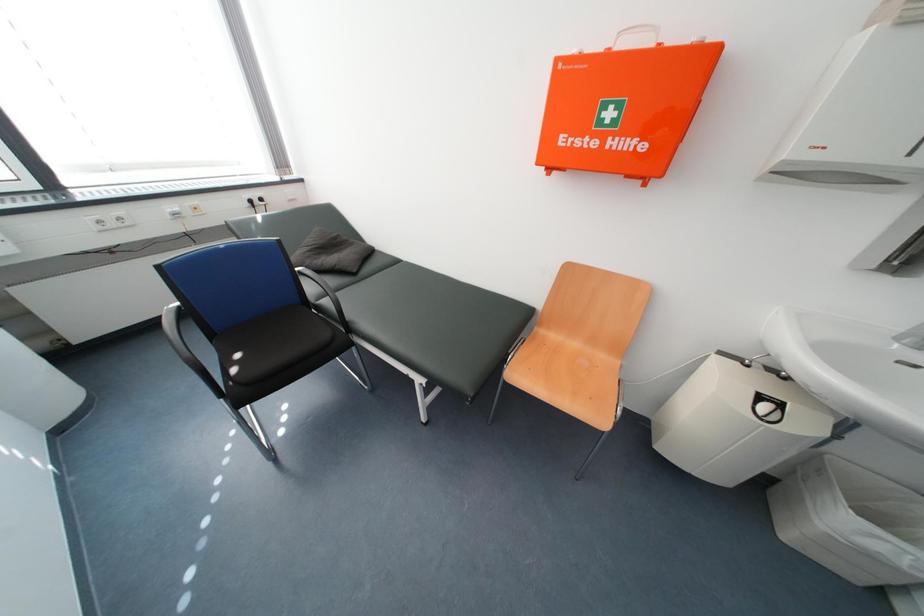
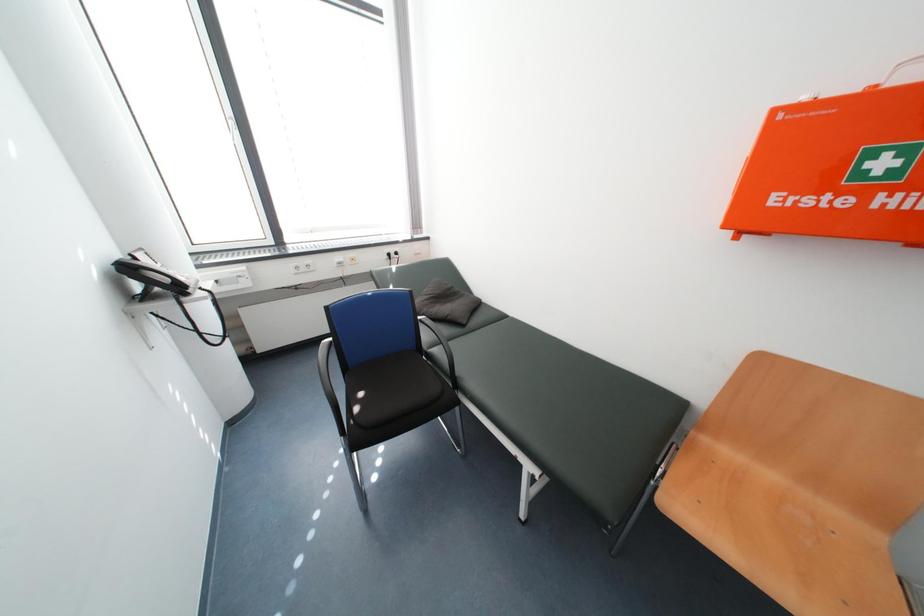
Question: How did the camera likely rotate?

Choices:
 (A) Left
 (B) Right
 (C) Up
 (D) Down

Answer: (A)